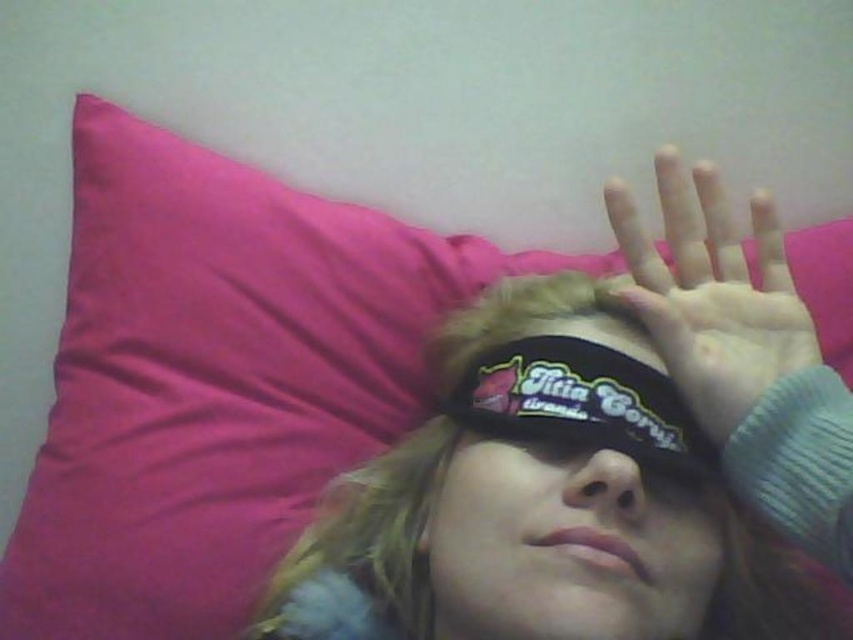
Does black fabric blindfold at center appear under black fabric eye mask at center?

Actually, black fabric blindfold at center is above black fabric eye mask at center.

Is black fabric blindfold at center thinner than black fabric eye mask at center?

In fact, black fabric blindfold at center might be wider than black fabric eye mask at center.

Which is in front, point (553, 520) or point (502, 381)?

Point (553, 520) is more forward.

You are a GUI agent. You are given a task and a screenshot of the screen. Output one action in this format:
    pyautogui.click(x=<x>, y=<y>)
    Task: Click on the black fabric blindfold at center
    The height and width of the screenshot is (640, 853).
    Given the screenshot: What is the action you would take?
    pyautogui.click(x=566, y=541)

Does matte black hand at upper right appear on the left side of black fabric eye mask at center?

No, matte black hand at upper right is not to the left of black fabric eye mask at center.

Is matte black hand at upper right positioned in front of black fabric eye mask at center?

No, matte black hand at upper right is behind black fabric eye mask at center.

Which is behind, point (694, 250) or point (608, 438)?

Point (694, 250)

Locate an element on the screen. Image resolution: width=853 pixels, height=640 pixels. matte black hand at upper right is located at coordinates (712, 292).

Is black fabric blindfold at center thinner than matte black hand at upper right?

Incorrect, black fabric blindfold at center's width is not less than matte black hand at upper right's.

Locate an element on the screen. This screenshot has height=640, width=853. black fabric blindfold at center is located at coordinates (566, 541).

Which is in front, point (567, 316) or point (764, 337)?

Point (764, 337) is more forward.

At what (x,y) coordinates should I click in order to perform the action: click on black fabric blindfold at center. Please return your answer as a coordinate pair (x, y). This screenshot has width=853, height=640. Looking at the image, I should click on (566, 541).